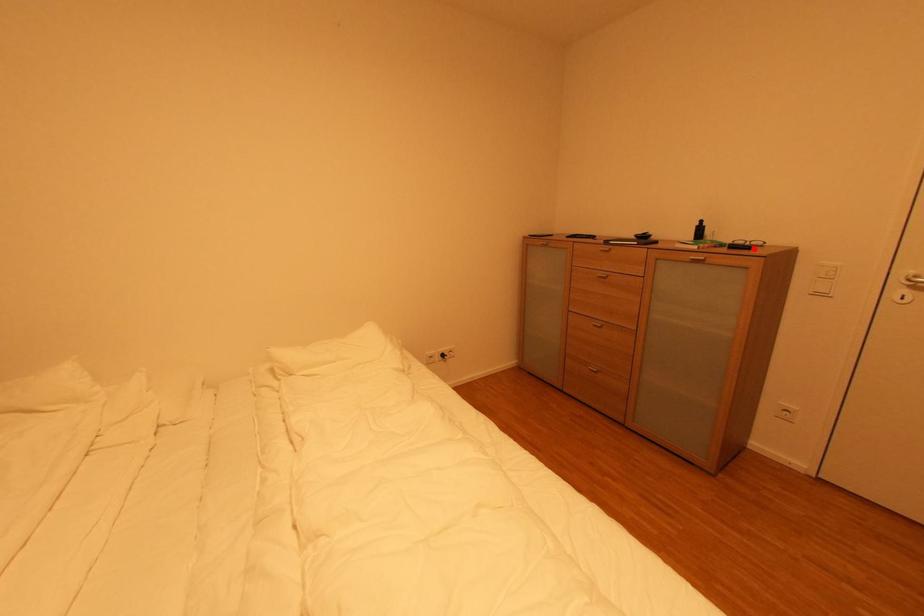
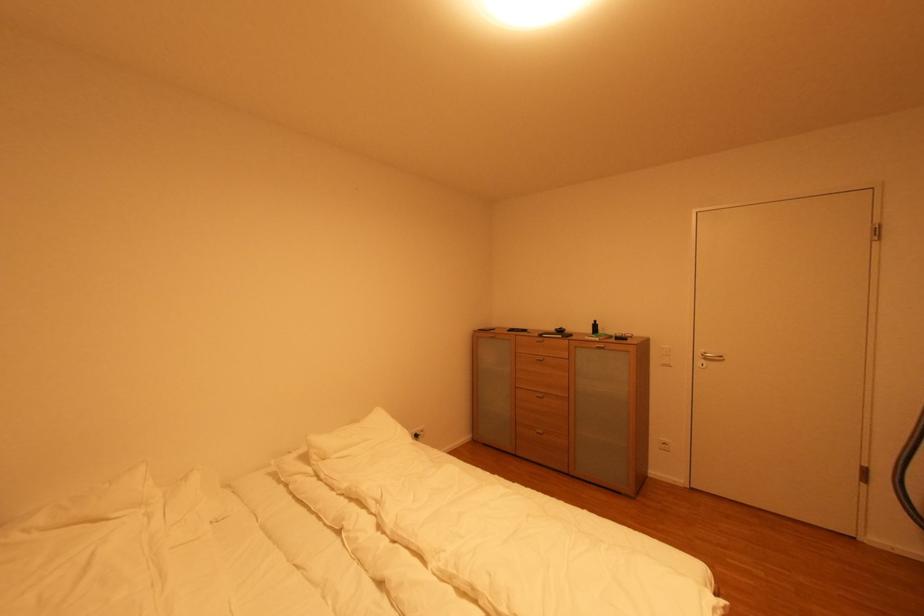
Locate, in the second image, the point that corresponds to the highlighted location in the first image.

(630, 339)